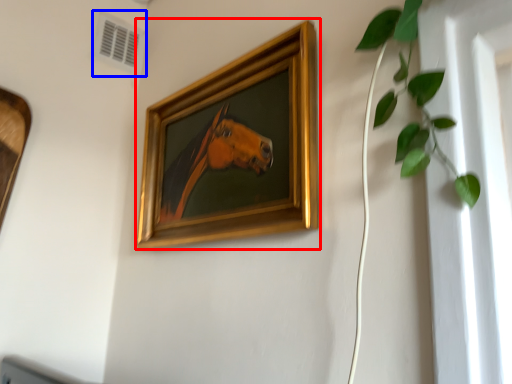
Question: Which of the following is the closest to the observer, picture frame (highlighted by a red box) or air conditioning (highlighted by a blue box)?

Choices:
 (A) picture frame
 (B) air conditioning

Answer: (A)